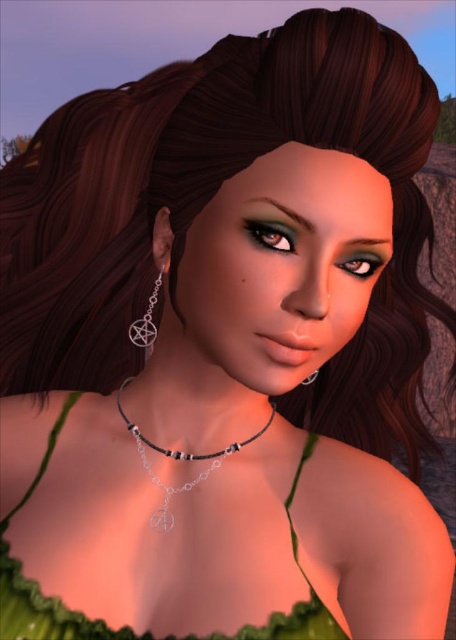
Looking at this image, can you confirm if green fabric dress at center is taller than silver metallic pentagram at center?

Yes.

Is green fabric dress at center closer to the viewer compared to silver metallic pentagram at center?

Yes.

Is point (310, 632) less distant than point (312, 380)?

That is True.

Locate an element on the screen. green fabric dress at center is located at coordinates (39, 586).

Does green fabric dress at center appear over silver metallic necklace at center?

Incorrect, green fabric dress at center is not positioned above silver metallic necklace at center.

Image resolution: width=456 pixels, height=640 pixels. I want to click on green fabric dress at center, so click(39, 586).

Does silver metallic pentagram at ear have a lesser height compared to silver metallic pentagram at center?

No.

Is point (151, 314) behind point (309, 378)?

Yes, it is behind point (309, 378).

You are a GUI agent. You are given a task and a screenshot of the screen. Output one action in this format:
    pyautogui.click(x=<x>, y=<y>)
    Task: Click on the silver metallic pentagram at ear
    This screenshot has height=640, width=456.
    Given the screenshot: What is the action you would take?
    pyautogui.click(x=146, y=317)